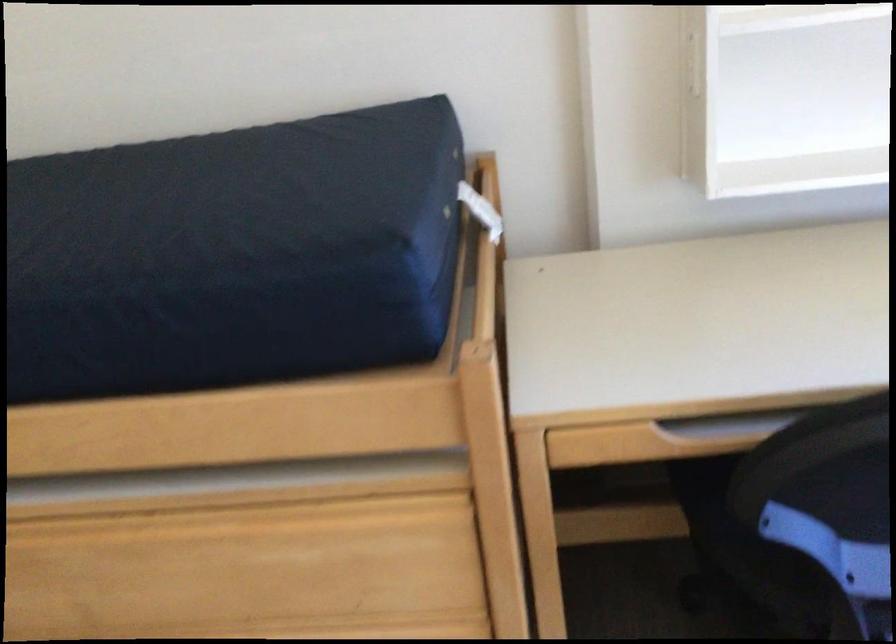
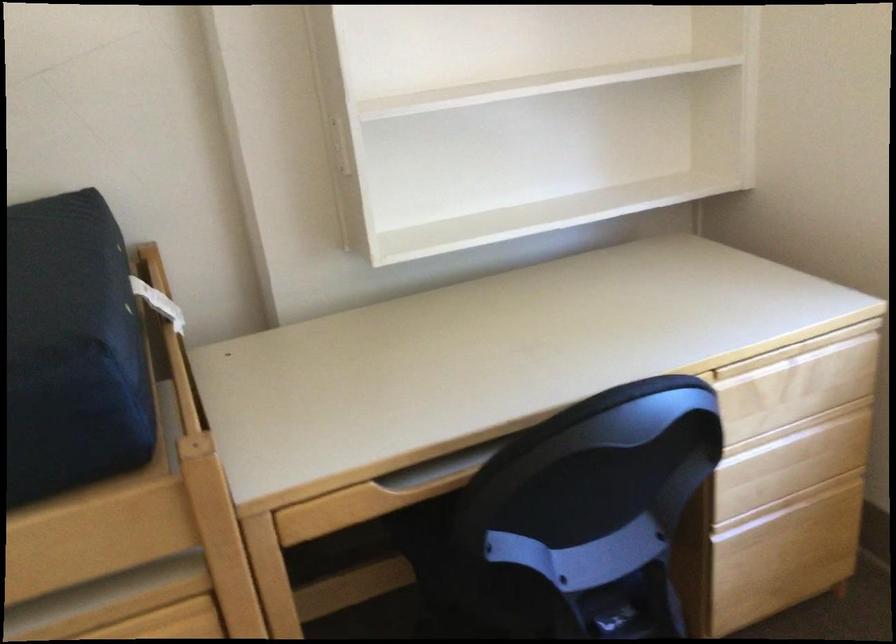
Find the pixel in the second image that matches [716,442] in the first image.

(431, 489)